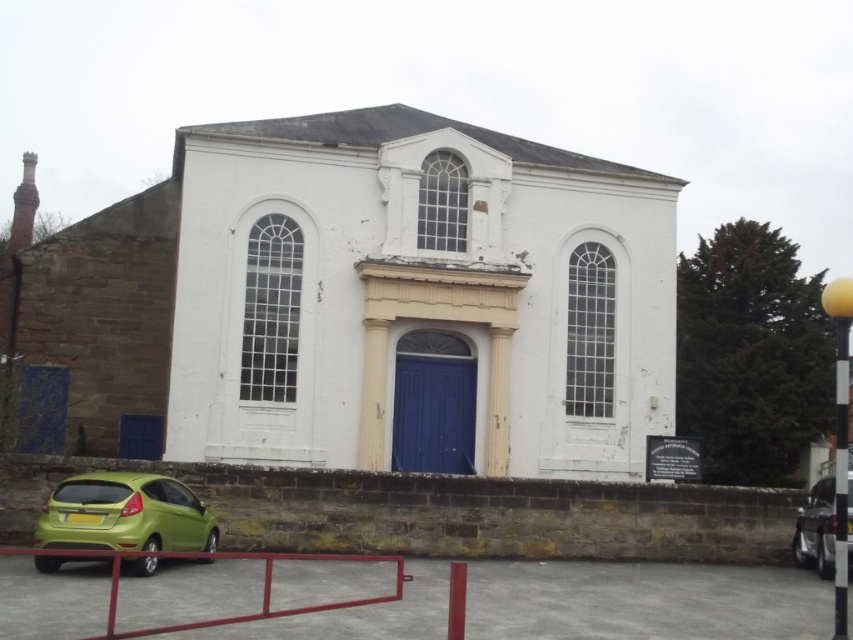
Between white painted wood chapel at center and metallic red barrier at lower left, which one is positioned lower?

Answer: metallic red barrier at lower left is lower down.

Based on the photo, is the position of white painted wood chapel at center less distant than that of metallic red barrier at lower left?

No, it is behind metallic red barrier at lower left.

The image size is (853, 640). Identify the location of white painted wood chapel at center. (363, 298).

Locate an element on the screen. Image resolution: width=853 pixels, height=640 pixels. white painted wood chapel at center is located at coordinates (363, 298).

Who is more forward, (567, 548) or (448, 401)?

Point (567, 548) is in front.

Which is more to the right, metallic red barrier at lower left or blue painted wood door at center?

blue painted wood door at center is more to the right.

Who is more forward, (334, 538) or (425, 401)?

Point (334, 538) is more forward.

This screenshot has height=640, width=853. In order to click on metallic red barrier at lower left in this screenshot , I will do `click(445, 513)`.

How distant is metallic red barrier at lower left from green matte car at lower left?

A distance of 22.26 feet exists between metallic red barrier at lower left and green matte car at lower left.

Is point (508, 508) farther from camera compared to point (811, 554)?

Yes, point (508, 508) is behind point (811, 554).

Identify the location of metallic red barrier at lower left. Image resolution: width=853 pixels, height=640 pixels. (445, 513).